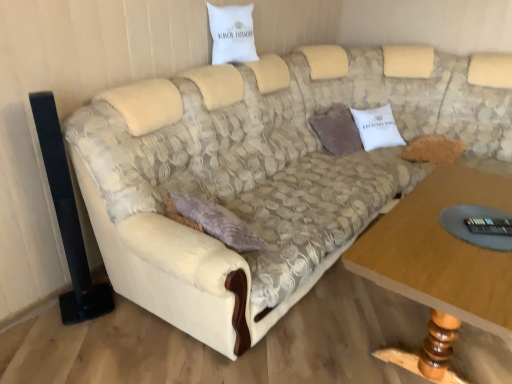
What are the coordinates of `blank space situated above wooden table at lower right (from a real-world perspective)` in the screenshot? It's located at (459, 223).